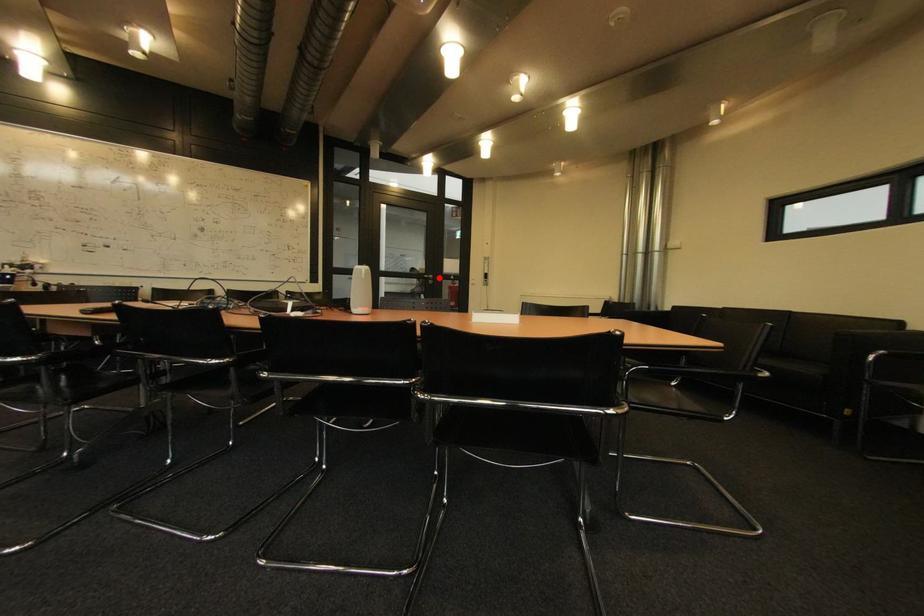
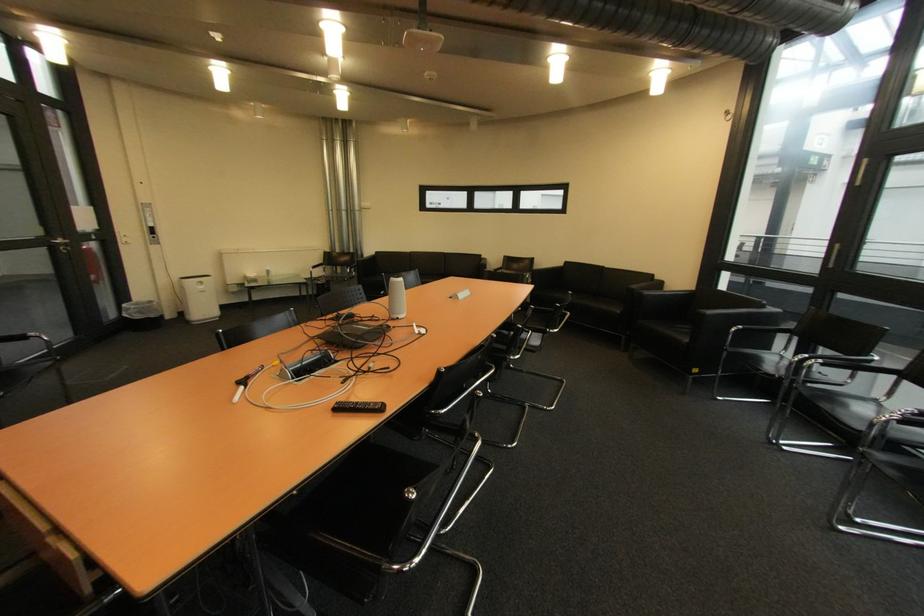
Question: I am providing you with two images of the same scene from different viewpoints. In image1, a red point is highlighted. Considering the same 3D point in image2, which of the following is correct?

Choices:
 (A) It is closer
 (B) It is farther

Answer: (B)